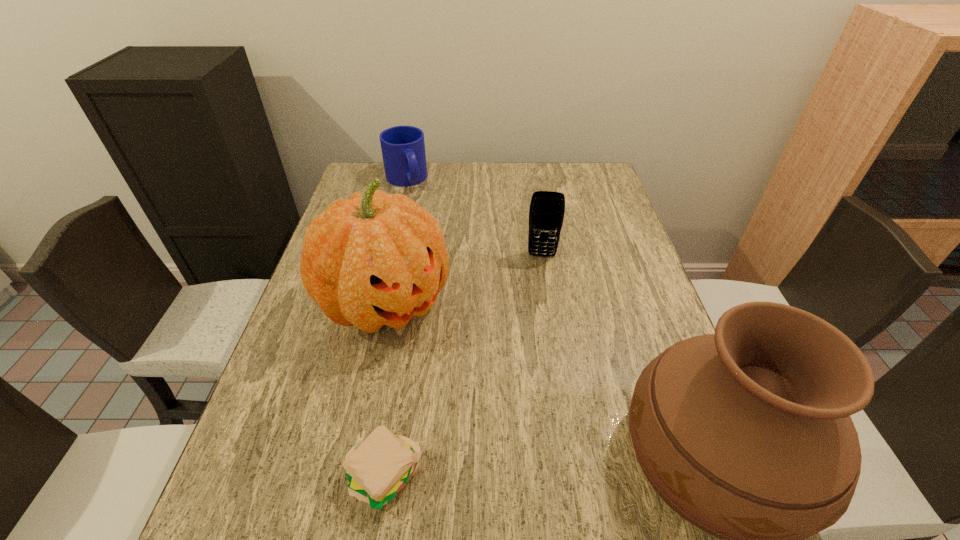
I want to click on patty, so click(x=380, y=468).

Image resolution: width=960 pixels, height=540 pixels. What are the coordinates of `cellular telephone` in the screenshot? It's located at (546, 214).

Locate an element on the screen. Image resolution: width=960 pixels, height=540 pixels. the third shortest object is located at coordinates (546, 214).

Find the location of a particular element. The height and width of the screenshot is (540, 960). pumpkin is located at coordinates (376, 259).

Locate an element on the screen. The height and width of the screenshot is (540, 960). the fourth tallest object is located at coordinates (403, 148).

This screenshot has height=540, width=960. I want to click on the farthest object, so click(403, 148).

Locate an element on the screen. blank space located 0.160m on the back of the patty is located at coordinates (401, 370).

Locate an element on the screen. This screenshot has width=960, height=540. free space located 0.380m on the screen of the cellular telephone is located at coordinates (539, 375).

At what (x,y) coordinates should I click in order to perform the action: click on vacant space located 0.130m on the screen of the cellular telephone. Please return your answer as a coordinate pair (x, y). The image size is (960, 540). Looking at the image, I should click on (540, 294).

Where is `free region located on the screen of the cellular telephone`? The width and height of the screenshot is (960, 540). free region located on the screen of the cellular telephone is located at coordinates pyautogui.click(x=540, y=349).